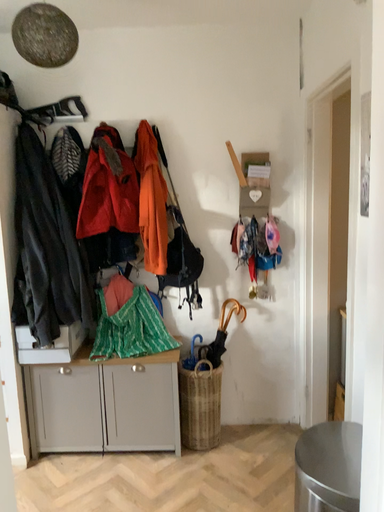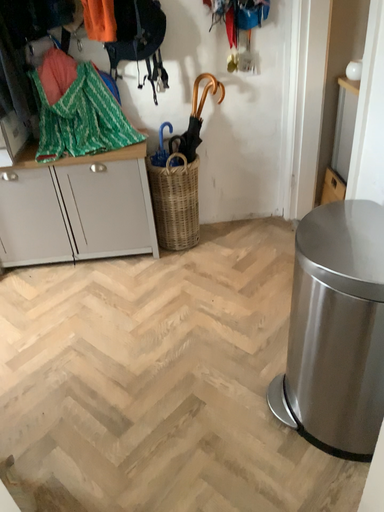
Question: How did the camera likely rotate when shooting the video?

Choices:
 (A) rotated upward
 (B) rotated downward

Answer: (B)